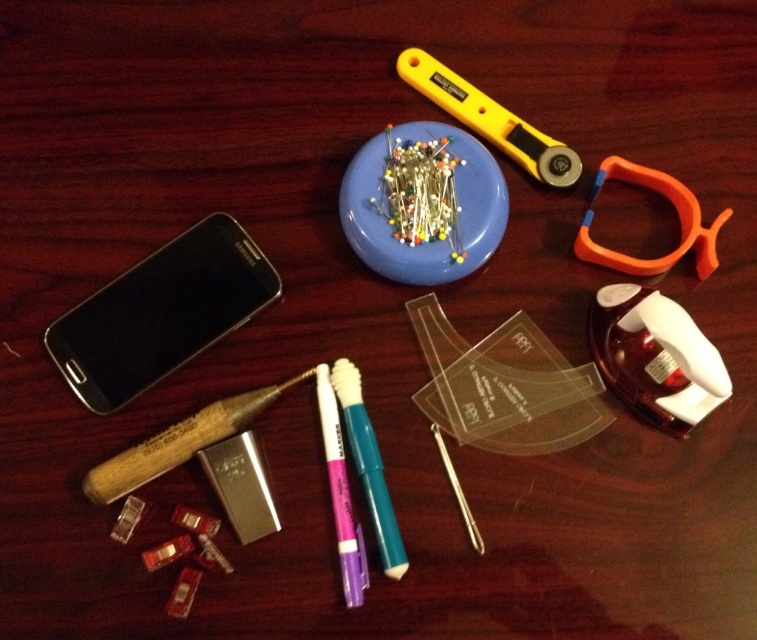
Is the position of yellow plastic scissors at upper center less distant than that of matte plastic markers at center?

That is False.

Is point (646, 262) behind point (400, 566)?

Yes, point (646, 262) is behind point (400, 566).

You are a GUI agent. You are given a task and a screenshot of the screen. Output one action in this format:
    pyautogui.click(x=<x>, y=<y>)
    Task: Click on the yellow plastic scissors at upper center
    
    Given the screenshot: What is the action you would take?
    pyautogui.click(x=488, y=120)

Identify the location of yellow plastic scissors at upper center. (488, 120).

Where is `blue plastic plate at center`? The image size is (757, 640). blue plastic plate at center is located at coordinates (422, 204).

Between point (432, 125) and point (693, 234), which one is positioned in front?

Positioned in front is point (693, 234).

Find the location of a particular element. Image resolution: width=757 pixels, height=640 pixels. blue plastic plate at center is located at coordinates (422, 204).

Based on the photo, which is above, orange plastic scissors at upper right or purple matte pen at center?

orange plastic scissors at upper right is above.

Looking at this image, does orange plastic scissors at upper right appear over purple matte pen at center?

Yes.

Is point (593, 189) closer to camera compared to point (316, 381)?

No, (593, 189) is further to viewer.

You are a GUI agent. You are given a task and a screenshot of the screen. Output one action in this format:
    pyautogui.click(x=<x>, y=<y>)
    Task: Click on the orange plastic scissors at upper right
    This screenshot has width=757, height=640.
    Given the screenshot: What is the action you would take?
    pyautogui.click(x=678, y=220)